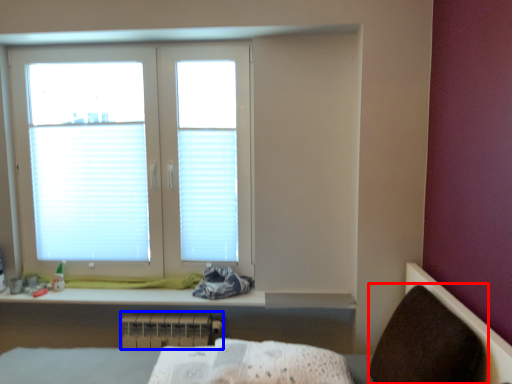
Question: Which object appears closest to the camera in this image, armchair (highlighted by a red box) or radiator (highlighted by a blue box)?

Choices:
 (A) armchair
 (B) radiator

Answer: (A)